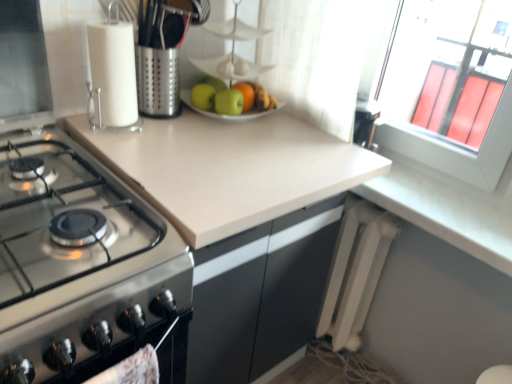
Question: Does green matte apple at center, which is the second apple in left-to-right order, have a greater height compared to green matte apple at center, the 2th apple in the right-to-left sequence?

Choices:
 (A) no
 (B) yes

Answer: (B)

Question: Considering the relative sizes of green matte apple at center, which is the second apple in left-to-right order, and green matte apple at center, the first apple when ordered from left to right, in the image provided, is green matte apple at center, which is the second apple in left-to-right order, wider than green matte apple at center, the first apple when ordered from left to right,?

Choices:
 (A) no
 (B) yes

Answer: (B)

Question: Is green matte apple at center, which is the second apple in left-to-right order, bigger than green matte apple at center, the 2th apple in the right-to-left sequence?

Choices:
 (A) yes
 (B) no

Answer: (A)

Question: From a real-world perspective, is green matte apple at center, which is the 1th apple from right to left, located higher than green matte apple at center, the first apple when ordered from left to right?

Choices:
 (A) no
 (B) yes

Answer: (B)

Question: Is green matte apple at center, which is the 1th apple from right to left, thinner than green matte apple at center, the 2th apple in the right-to-left sequence?

Choices:
 (A) no
 (B) yes

Answer: (A)

Question: From a real-world perspective, is green matte apple at center, which is the 1th apple from right to left, above or below white paper towel holder at upper left?

Choices:
 (A) below
 (B) above

Answer: (A)

Question: Is green matte apple at center, which is the 1th apple from right to left, bigger or smaller than white paper towel holder at upper left?

Choices:
 (A) small
 (B) big

Answer: (A)

Question: Considering their positions, is green matte apple at center, which is the second apple in left-to-right order, located in front of or behind white paper towel holder at upper left?

Choices:
 (A) behind
 (B) front

Answer: (A)

Question: Is green matte apple at center, which is the 1th apple from right to left, inside the boundaries of white paper towel holder at upper left, or outside?

Choices:
 (A) inside
 (B) outside

Answer: (B)

Question: In terms of height, does green matte apple at center, the first apple when ordered from left to right, look taller or shorter compared to beige laminate countertop at center?

Choices:
 (A) tall
 (B) short

Answer: (B)

Question: Looking at the image, does green matte apple at center, the first apple when ordered from left to right, seem bigger or smaller compared to beige laminate countertop at center?

Choices:
 (A) big
 (B) small

Answer: (B)

Question: In the image, is green matte apple at center, the first apple when ordered from left to right, positioned in front of or behind beige laminate countertop at center?

Choices:
 (A) front
 (B) behind

Answer: (B)

Question: Based on their positions, is green matte apple at center, the 2th apple in the right-to-left sequence, located to the left or right of beige laminate countertop at center?

Choices:
 (A) left
 (B) right

Answer: (A)

Question: Considering the relative positions of glossy orange at center and stainless steel gas stove at left in the image provided, is glossy orange at center to the left or to the right of stainless steel gas stove at left?

Choices:
 (A) right
 (B) left

Answer: (A)

Question: From their relative heights in the image, would you say glossy orange at center is taller or shorter than stainless steel gas stove at left?

Choices:
 (A) short
 (B) tall

Answer: (A)